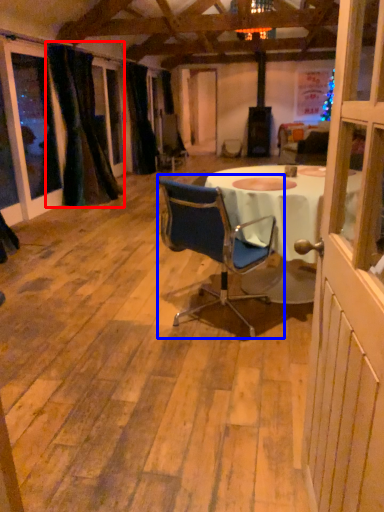
Question: Which object is closer to the camera taking this photo, curtain (highlighted by a red box) or chair (highlighted by a blue box)?

Choices:
 (A) curtain
 (B) chair

Answer: (B)